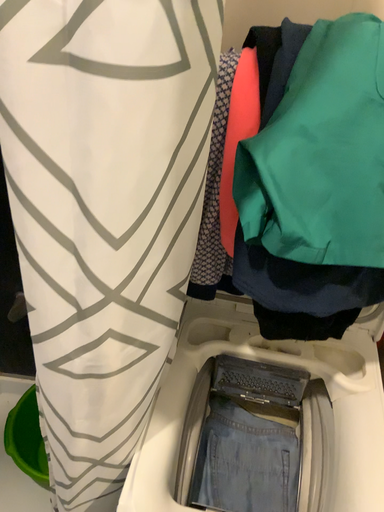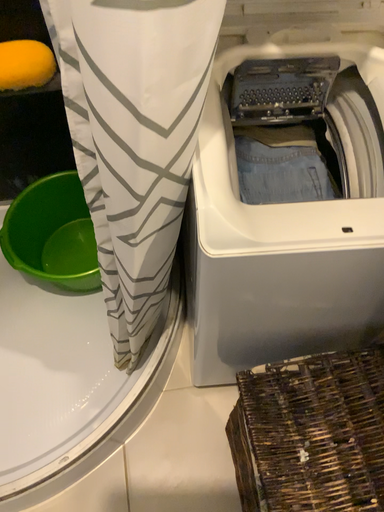
Question: Which way did the camera rotate in the video?

Choices:
 (A) rotated downward
 (B) rotated upward

Answer: (A)